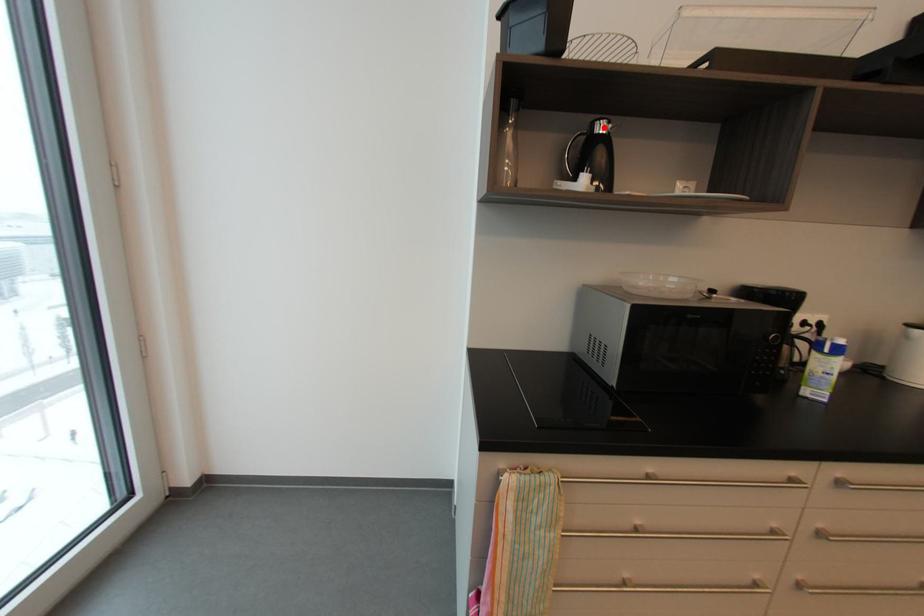
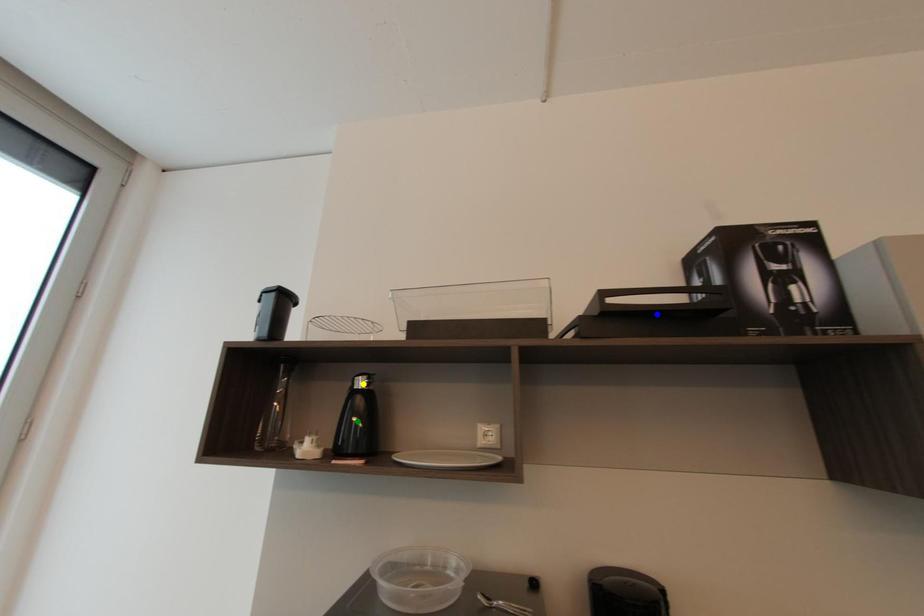
Question: I am providing you with two images of the same scene from different viewpoints. A red point is marked on the first image. You are given multiple points on the second image. Which mark in image 2 goes with the point in image 1?

Choices:
 (A) yellow point
 (B) blue point
 (C) green point

Answer: (A)